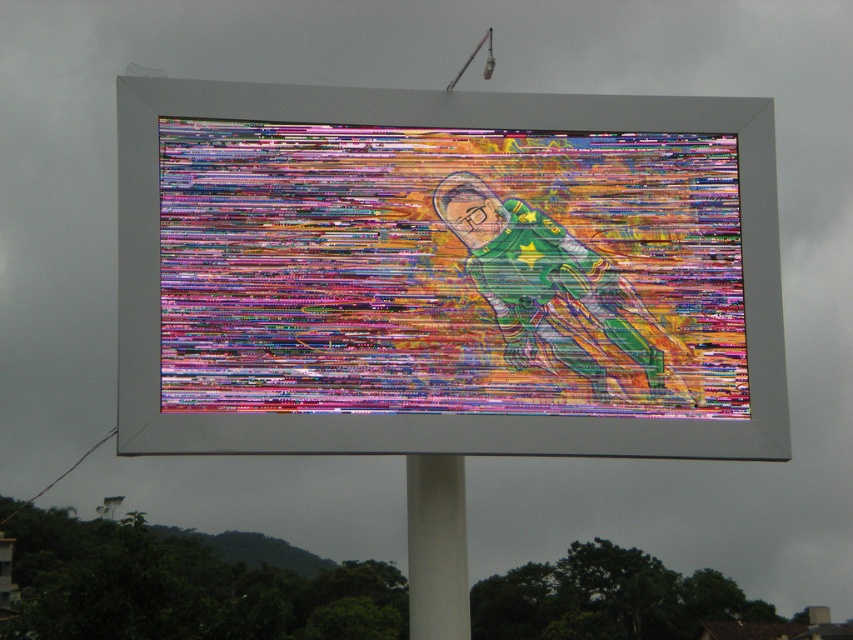
You are standing in front of the billboard and want to take a photo of the glitchy digital art at center. Where should you aim your camera to capture it perfectly?

You should aim your camera at point coordinates (448, 269) to capture the glitchy digital art at center perfectly.

You are standing in front of the billboard and want to take a photo of the glitchy digital art at center and the white matte pole at center. Which one should you focus on first if you want to capture both in the same frame?

You should focus on the glitchy digital art at center first because it is positioned to the right of the white matte pole at center, so adjusting the camera to include both would require framing from the left side where the pole is located outward toward the art.

You are a photographer standing in front of the billboard. You want to take a clear photo of the white matte pole at center without the glitchy digital art at center blocking it. Is this possible?

The glitchy digital art at center is in front of the white matte pole at center, so it will block the view. To take a clear photo of the white matte pole at center without the glitchy digital art at center, you would need to move around to a position where the pole is visible behind the artwork or adjust your angle to avoid the obstruction.